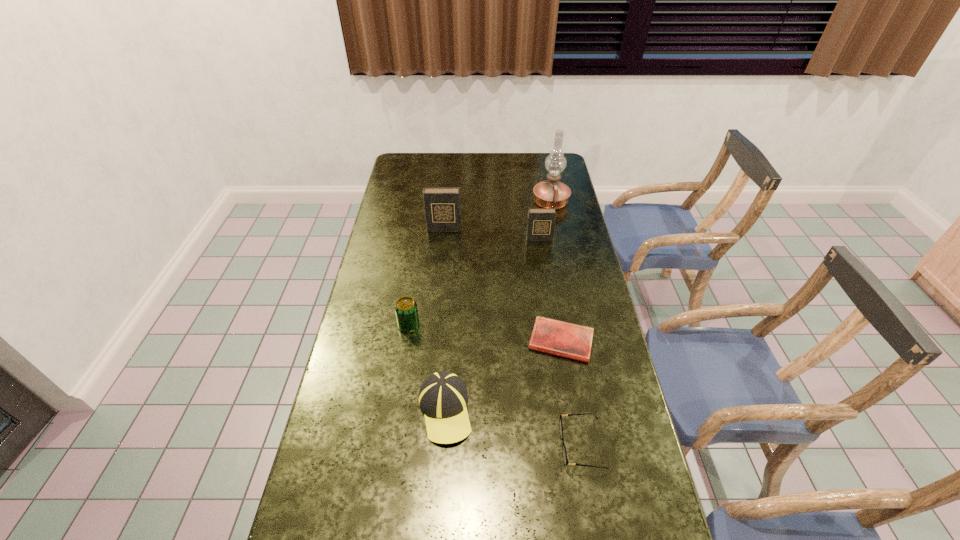
You are a GUI agent. You are given a task and a screenshot of the screen. Output one action in this format:
    pyautogui.click(x=<x>, y=<y>)
    Task: Click on the farthest object
    
    Given the screenshot: What is the action you would take?
    pyautogui.click(x=547, y=194)

Where is `the tallest object`? the tallest object is located at coordinates (547, 194).

This screenshot has height=540, width=960. I want to click on the farthest diary, so click(442, 205).

Locate an element on the screen. The image size is (960, 540). the bigger dark diary is located at coordinates (442, 205).

Find the location of a particular element. This screenshot has width=960, height=540. the smaller dark diary is located at coordinates [541, 222].

Where is `the third tallest object`? the third tallest object is located at coordinates (541, 222).

Locate an element on the screen. beer can is located at coordinates (406, 310).

I want to click on green beer can, so click(x=406, y=310).

This screenshot has width=960, height=540. Identify the location of black baseball cap. (443, 397).

Identify the location of baseball cap. The width and height of the screenshot is (960, 540). (443, 397).